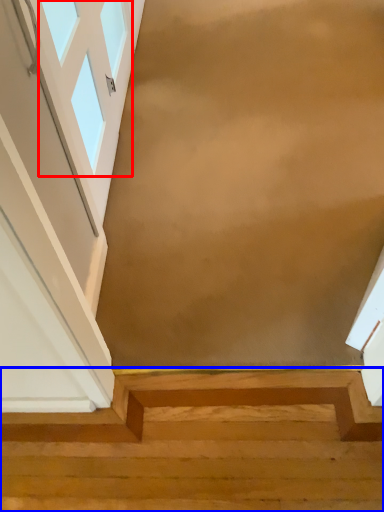
Question: Which object is further to the camera taking this photo, window (highlighted by a red box) or stairs (highlighted by a blue box)?

Choices:
 (A) window
 (B) stairs

Answer: (B)